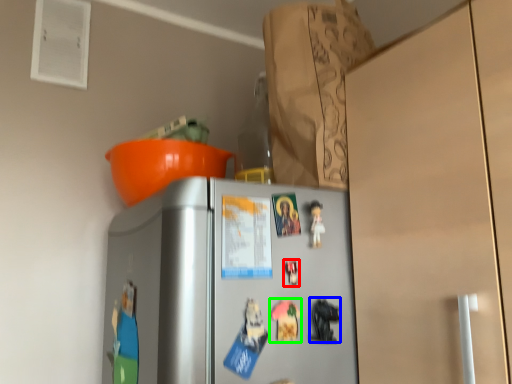
Question: Which object is the farthest from toy (highlighted by a red box)? Choose among these: toy (highlighted by a blue box) or toy (highlighted by a green box).

Choices:
 (A) toy
 (B) toy

Answer: (A)